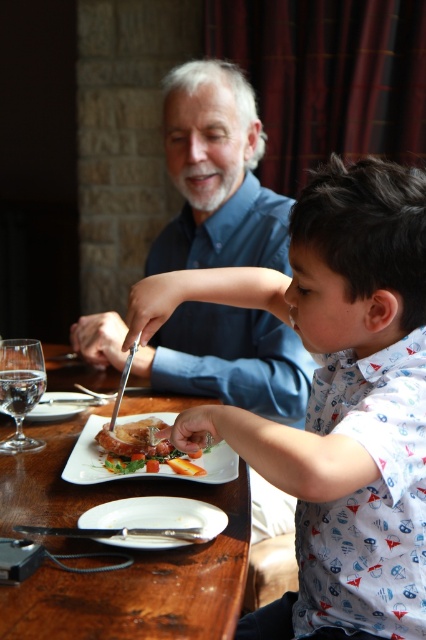
Question: Which point is closer to the camera?

Choices:
 (A) (149, 436)
 (B) (5, 460)
 (C) (164, 140)

Answer: (B)

Question: Which point is closer to the camera taking this photo?

Choices:
 (A) (131, 442)
 (B) (175, 544)

Answer: (B)

Question: Which point is closer to the camera?

Choices:
 (A) white matte plate at lower center
 (B) white cotton shirt at center
 (C) clear glass wine glass at left

Answer: (B)

Question: In this image, where is white cotton shirt at center located relative to golden brown crispy chicken at center?

Choices:
 (A) above
 (B) below

Answer: (A)

Question: Can you confirm if white cotton shirt at center is thinner than clear glass wine glass at left?

Choices:
 (A) yes
 (B) no

Answer: (B)

Question: Can you confirm if white cotton shirt at center is wider than golden brown crispy chicken at center?

Choices:
 (A) no
 (B) yes

Answer: (B)